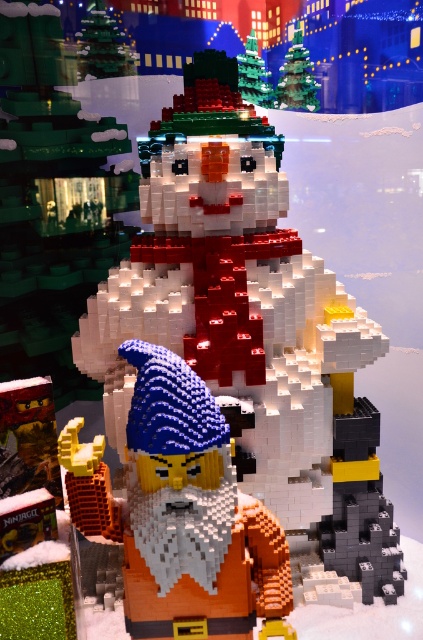
Question: Estimate the real-world distances between objects in this image. Which object is farther from the matte white snowman at center?

Choices:
 (A) orange matte/glossy wizard at lower left
 (B) green matte christmas tree at upper center

Answer: (A)

Question: Considering the relative positions of white matte snowman at center and matte white snowman at center in the image provided, where is white matte snowman at center located with respect to matte white snowman at center?

Choices:
 (A) below
 (B) above

Answer: (A)

Question: Can you confirm if orange matte/glossy wizard at lower left is bigger than matte white snowman at center?

Choices:
 (A) no
 (B) yes

Answer: (B)

Question: Is the position of orange matte/glossy wizard at lower left less distant than that of matte white snowman at center?

Choices:
 (A) yes
 (B) no

Answer: (A)

Question: Which object is closer to the camera taking this photo?

Choices:
 (A) matte white snowman at center
 (B) green matte christmas tree at upper center
 (C) orange matte/glossy wizard at lower left
 (D) white matte snowman at center

Answer: (C)

Question: Which is farther from the matte white snowman at center?

Choices:
 (A) green matte christmas tree at upper center
 (B) orange matte/glossy wizard at lower left
 (C) white matte snowman at center

Answer: (B)